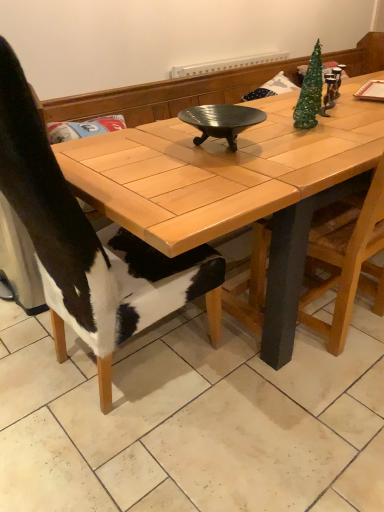
Identify the location of free spot in front of black ribbed metal wok at center. The width and height of the screenshot is (384, 512). (225, 173).